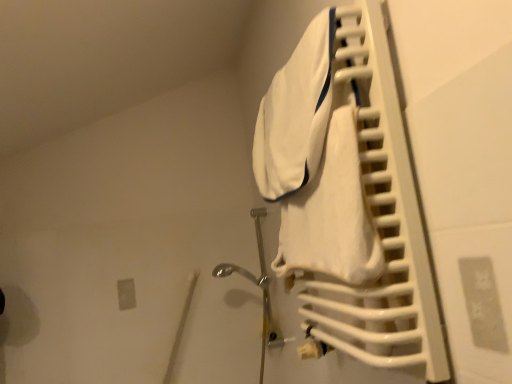
Find the location of a particular element. The height and width of the screenshot is (384, 512). white glossy towel rack at upper right is located at coordinates (379, 219).

The width and height of the screenshot is (512, 384). What do you see at coordinates (379, 219) in the screenshot? I see `white glossy towel rack at upper right` at bounding box center [379, 219].

Locate an element on the screen. The height and width of the screenshot is (384, 512). white glossy towel rack at upper right is located at coordinates (379, 219).